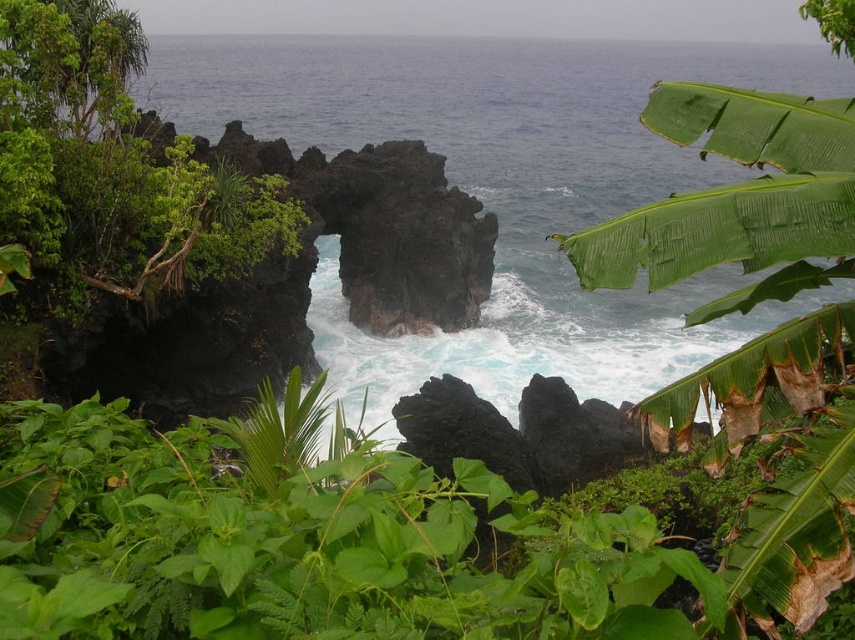
Question: Which of the following is the closest to the observer?

Choices:
 (A) (709, 196)
 (B) (606, 310)

Answer: (A)

Question: Estimate the real-world distances between objects in this image. Which object is closer to the blue water at center?

Choices:
 (A) green leafy shrub at left
 (B) green leafy banana tree at right

Answer: (B)

Question: Is blue water at center positioned at the back of green leafy shrub at left?

Choices:
 (A) no
 (B) yes

Answer: (A)

Question: Considering the relative positions of blue water at center and green leafy shrub at left in the image provided, where is blue water at center located with respect to green leafy shrub at left?

Choices:
 (A) above
 (B) below

Answer: (A)

Question: Which of the following is the farthest from the observer?

Choices:
 (A) (679, 401)
 (B) (121, 99)

Answer: (B)

Question: From the image, what is the correct spatial relationship of blue water at center in relation to green leafy banana tree at right?

Choices:
 (A) above
 (B) below

Answer: (A)